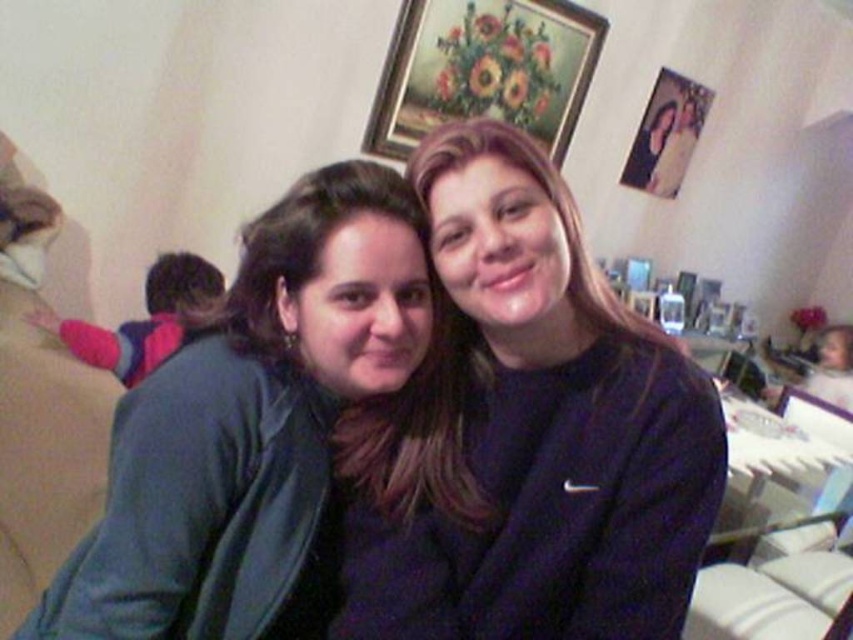
Question: Which point appears closest to the camera in this image?

Choices:
 (A) (177, 252)
 (B) (686, 104)
 (C) (531, 84)

Answer: (A)

Question: Can you confirm if matte green jacket at left is positioned to the right of wooden framed floral painting at upper center?

Choices:
 (A) yes
 (B) no

Answer: (B)

Question: Among these objects, which one is farthest from the camera?

Choices:
 (A) wooden framed floral painting at upper center
 (B) matte green jacket at left

Answer: (A)

Question: Is wooden framed floral painting at upper center wider than pink fleece jacket at left?

Choices:
 (A) no
 (B) yes

Answer: (B)

Question: Is matte green jacket at left further to the viewer compared to pink fleece jacket at left?

Choices:
 (A) yes
 (B) no

Answer: (B)

Question: Which point is farther to the camera?

Choices:
 (A) matte wooden photo frame at upper right
 (B) matte green jacket at left
 (C) wooden framed floral painting at upper center

Answer: (A)